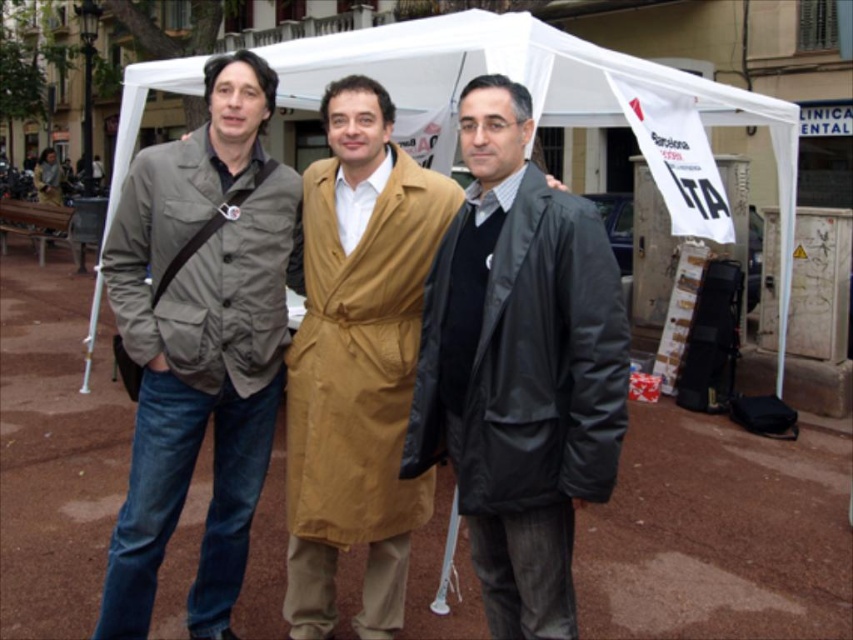
Between matte gray jacket at left and tan/waterproof trench coat at center, which one is positioned higher?

matte gray jacket at left is above.

Who is positioned more to the right, matte gray jacket at left or tan/waterproof trench coat at center?

tan/waterproof trench coat at center

This screenshot has height=640, width=853. What are the coordinates of `matte gray jacket at left` in the screenshot? It's located at (199, 340).

Measure the distance from tan/waterproof trench coat at center to white fabric canopy at center.

They are 4.50 meters apart.

Is point (345, 225) behind point (462, 49)?

No, (345, 225) is closer to viewer.

Image resolution: width=853 pixels, height=640 pixels. Identify the location of tan/waterproof trench coat at center. (357, 362).

Can you confirm if matte black coat at center is positioned above tan/waterproof trench coat at center?

Correct, matte black coat at center is located above tan/waterproof trench coat at center.

Is point (503, 388) positioned in front of point (399, 236)?

Yes, it is in front of point (399, 236).

Locate an element on the screen. This screenshot has height=640, width=853. matte black coat at center is located at coordinates (519, 368).